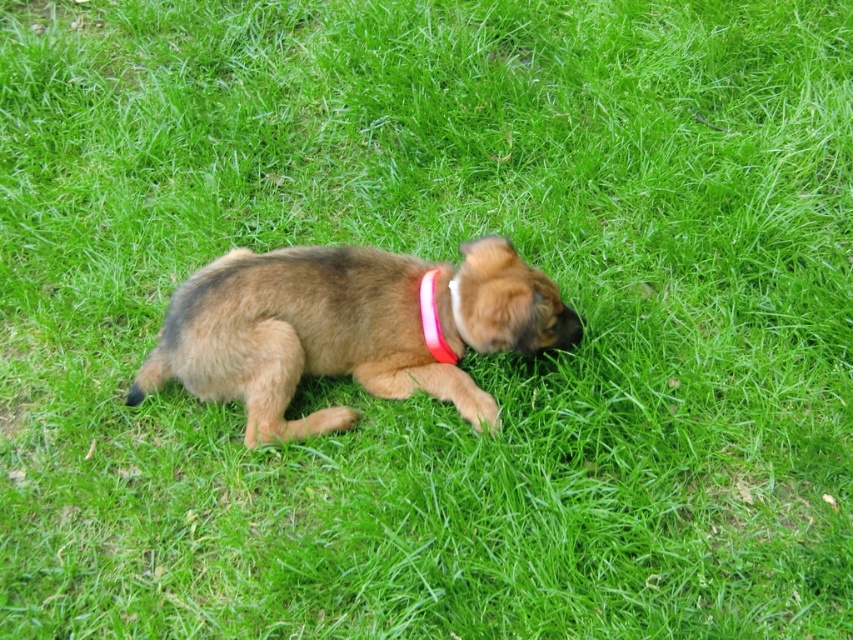
Question: Is brown furry dog at center wider than pink fabric neckband at center?

Choices:
 (A) no
 (B) yes

Answer: (B)

Question: Is brown furry dog at center thinner than pink fabric neckband at center?

Choices:
 (A) yes
 (B) no

Answer: (B)

Question: Is brown furry dog at center positioned at the back of pink fabric neckband at center?

Choices:
 (A) no
 (B) yes

Answer: (A)

Question: Among these objects, which one is farthest from the camera?

Choices:
 (A) pink fabric neckband at center
 (B) brown furry dog at center

Answer: (A)

Question: Which point appears farthest from the camera in this image?

Choices:
 (A) (347, 301)
 (B) (451, 362)

Answer: (B)